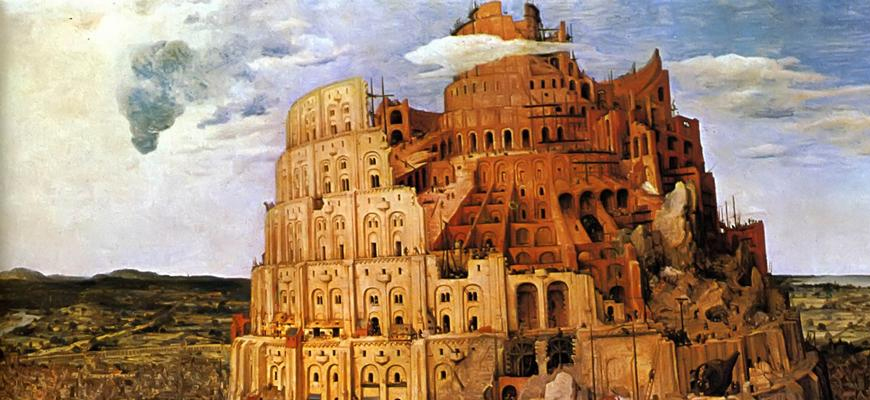
The image size is (870, 400). In order to click on window in this screenshot , I will do `click(338, 299)`.